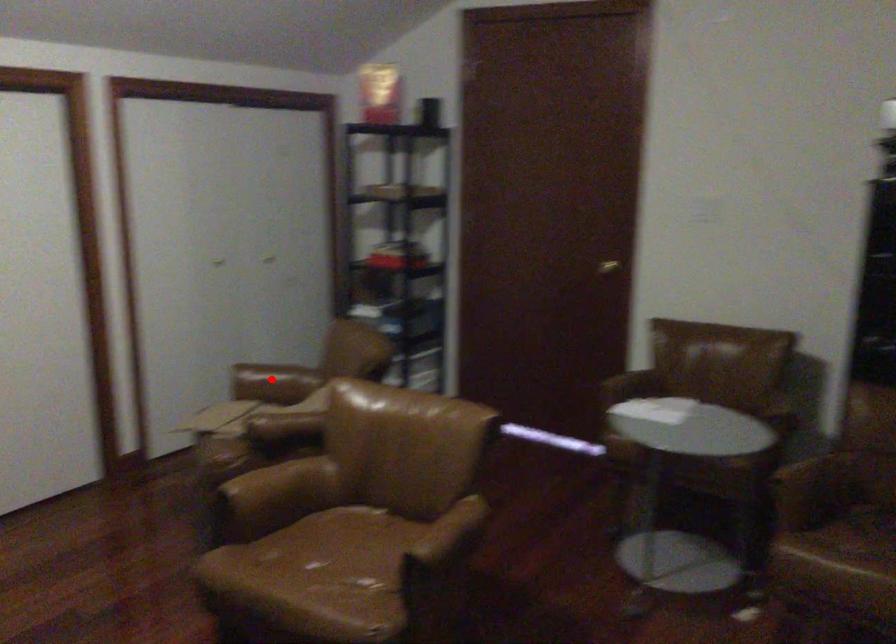
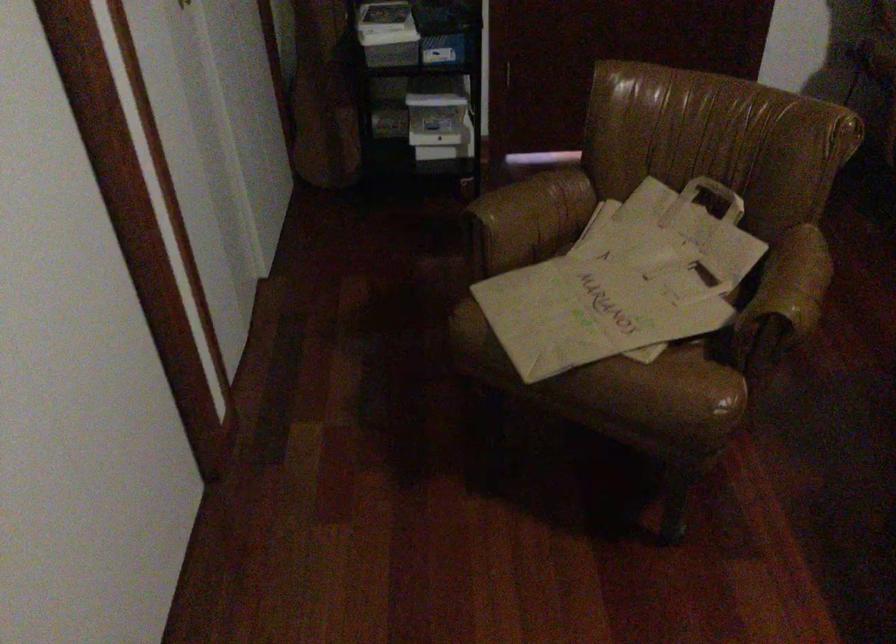
Question: I am providing you with two images of the same scene from different viewpoints. Image1 has a red point marked. In image2, the corresponding 3D location appears at what relative position? Reply with the corresponding letter.

Choices:
 (A) Closer
 (B) Farther

Answer: (A)